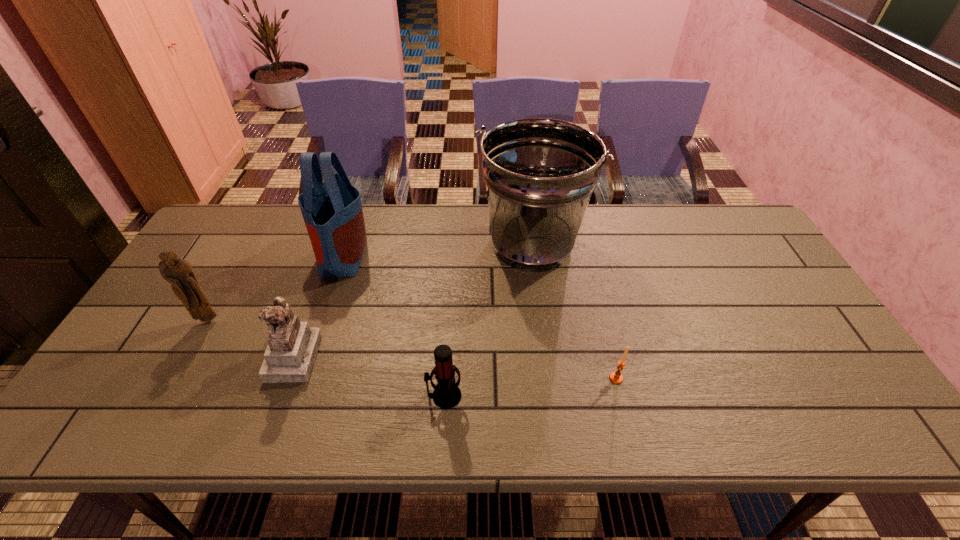
What are the coordinates of `vacant region that satisfies the following two spatial constraints: 1. on the front-facing side of the third shortest object; 2. on the right side of the candle_holder` in the screenshot? It's located at point(286,378).

Find the location of a particular element. This screenshot has width=960, height=540. free space in the image that satisfies the following two spatial constraints: 1. on the front-facing side of the third farthest object; 2. on the left side of the shortest object is located at coordinates (177, 378).

You are a GUI agent. You are given a task and a screenshot of the screen. Output one action in this format:
    pyautogui.click(x=<x>, y=<y>)
    Task: Click on the free space that satisfies the following two spatial constraints: 1. on the front-facing side of the microphone; 2. on the left side of the shorter figurine
    
    Given the screenshot: What is the action you would take?
    pyautogui.click(x=279, y=396)

Find the location of a particular element. This screenshot has height=540, width=960. free space that satisfies the following two spatial constraints: 1. on the front side of the bucket; 2. on the front-facing side of the shorter figurine is located at coordinates (543, 356).